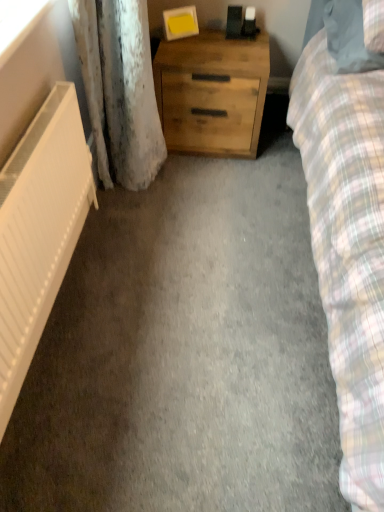
Question: From a real-world perspective, is white matte radiator at left positioned above or below natural wood chest of drawers at center?

Choices:
 (A) above
 (B) below

Answer: (B)

Question: Does point (54, 224) appear closer or farther from the camera than point (210, 116)?

Choices:
 (A) closer
 (B) farther

Answer: (A)

Question: Based on their relative distances, which object is farther from the transparent plastic window screen at upper left?

Choices:
 (A) white matte radiator at left
 (B) natural wood chest of drawers at center
 (C) plaid fabric pillow at upper right

Answer: (C)

Question: Which is farther from the natural wood chest of drawers at center?

Choices:
 (A) transparent plastic window screen at upper left
 (B) white matte radiator at left
 (C) plaid fabric pillow at upper right

Answer: (A)